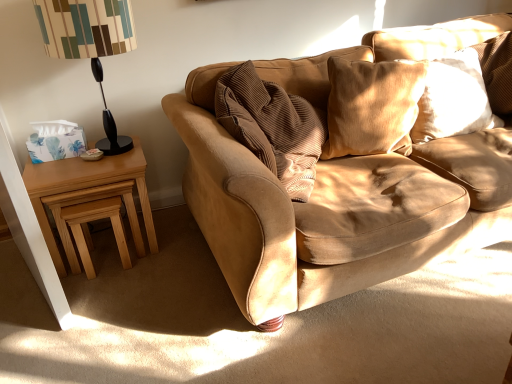
The height and width of the screenshot is (384, 512). Find the location of `vacant area that lies to the right of light brown wood nesting tables at left`. vacant area that lies to the right of light brown wood nesting tables at left is located at coordinates (178, 245).